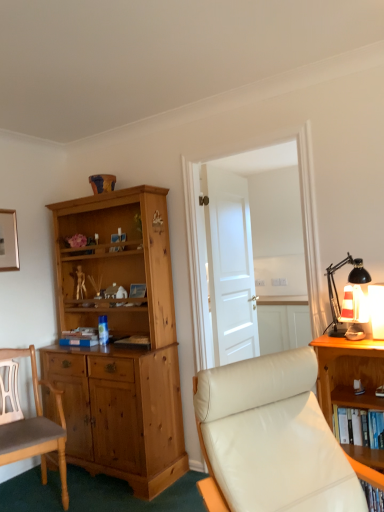
You are a GUI agent. You are given a task and a screenshot of the screen. Output one action in this format:
    pyautogui.click(x=<x>, y=<y>)
    Task: Click on the free region under light brown wood chair at left, the first chair positioned from the back (from a real-world perspective)
    The image size is (384, 512).
    Given the screenshot: What is the action you would take?
    pyautogui.click(x=46, y=498)